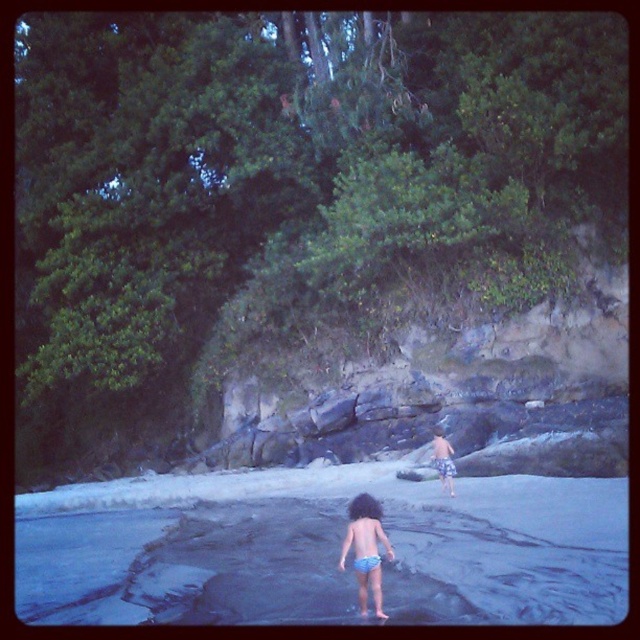
Consider the image. Who is higher up, blue rubber water at center or blue denim shorts at center?

blue denim shorts at center is higher up.

Is point (285, 612) less distant than point (364, 604)?

No, (285, 612) is further to viewer.

Locate an element on the screen. blue rubber water at center is located at coordinates (321, 548).

Who is shorter, blue rubber water at center or blue striped shorts at center?

With less height is blue striped shorts at center.

The image size is (640, 640). Identify the location of blue rubber water at center. (321, 548).

Does point (369, 516) come closer to viewer compared to point (451, 493)?

Yes.

Describe the element at coordinates (365, 548) in the screenshot. I see `blue denim shorts at center` at that location.

Is point (355, 541) more distant than point (442, 465)?

That is False.

Locate an element on the screen. This screenshot has height=640, width=640. blue denim shorts at center is located at coordinates (365, 548).